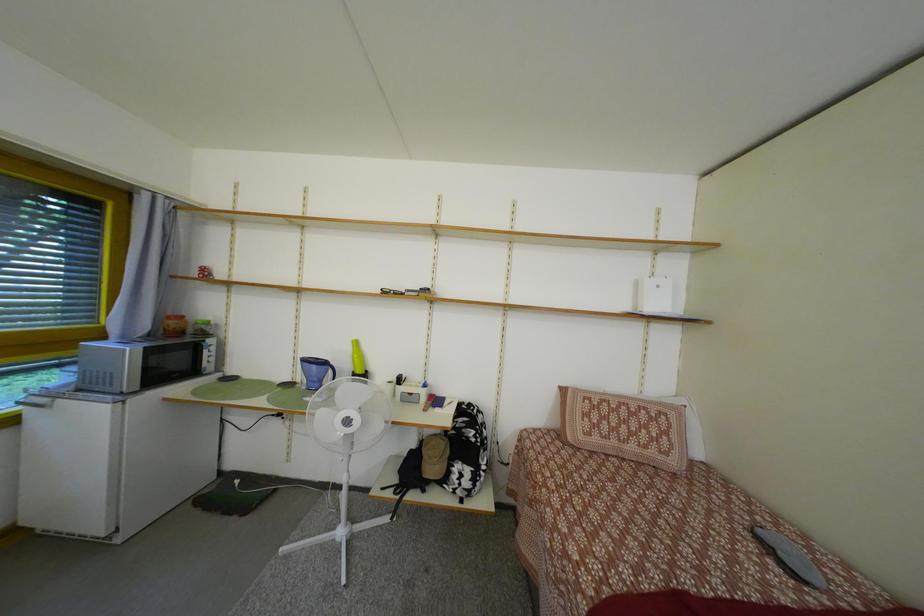
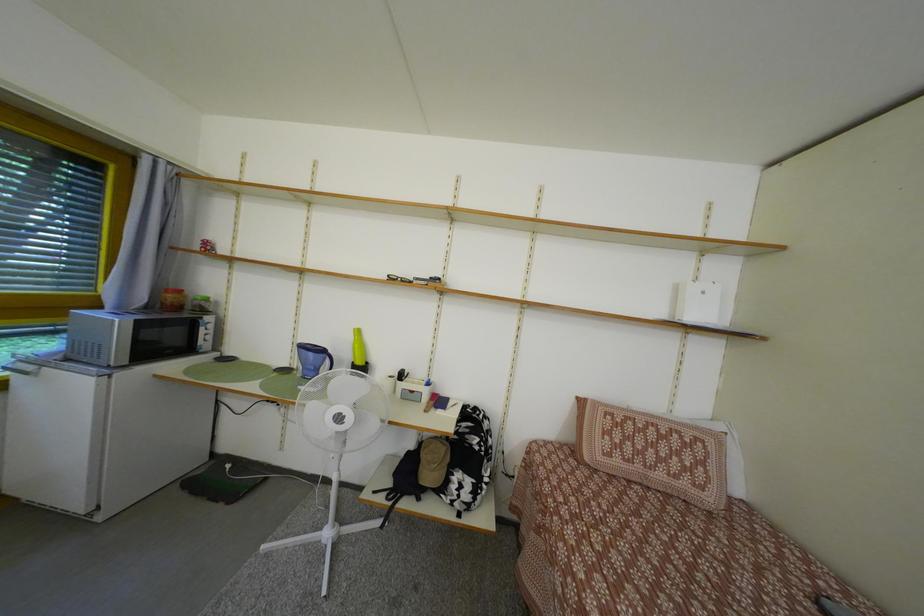
Question: The images are taken continuously from a first-person perspective. In which direction are you moving?

Choices:
 (A) Left
 (B) Right
 (C) Forward
 (D) Backward

Answer: (C)